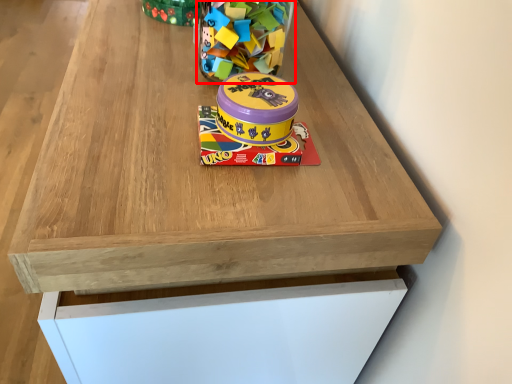
Question: In this image, where is toy (annotated by the red box) located relative to toy?

Choices:
 (A) right
 (B) left

Answer: (A)